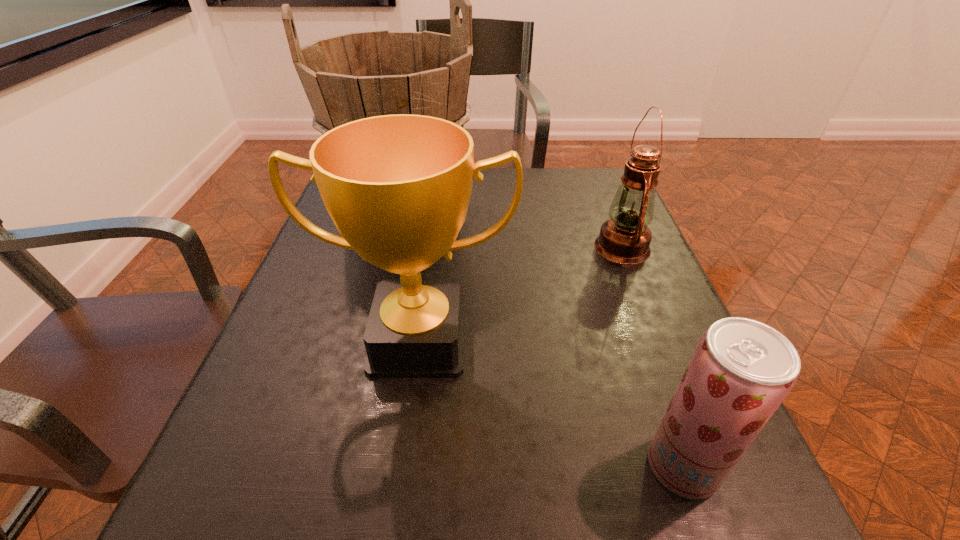
Locate an element on the screen. Image resolution: width=960 pixels, height=540 pixels. bucket is located at coordinates (352, 76).

At what (x,y) coordinates should I click in order to perform the action: click on award. Please return your answer as a coordinate pair (x, y). Looking at the image, I should click on (397, 187).

The width and height of the screenshot is (960, 540). Identify the location of oil lamp. (625, 238).

The height and width of the screenshot is (540, 960). In order to click on fruit juice in this screenshot , I will do [741, 371].

The width and height of the screenshot is (960, 540). I want to click on the shortest object, so click(741, 371).

This screenshot has height=540, width=960. Find the location of `vacant space located on the front of the bucket`. vacant space located on the front of the bucket is located at coordinates (381, 308).

Find the location of a particular element. blank area located 0.170m on the front-facing side of the third farthest object is located at coordinates (398, 489).

Find the location of a particular element. The width and height of the screenshot is (960, 540). free location located 0.150m on the left of the oil lamp is located at coordinates (531, 247).

What are the coordinates of `free space located 0.230m on the left of the fruit juice` in the screenshot? It's located at (491, 466).

Where is `object positioned at the far edge`? object positioned at the far edge is located at coordinates (352, 76).